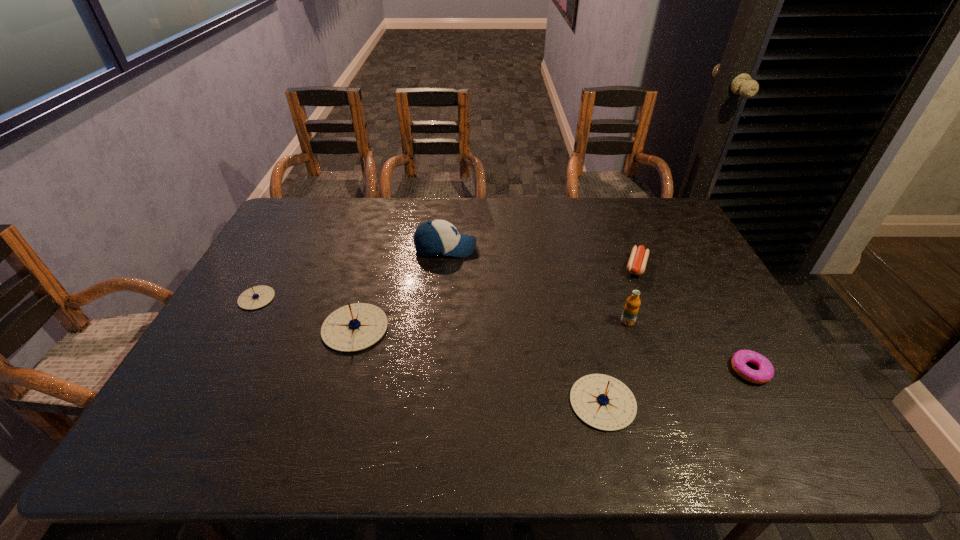
To ensure equal spacing by inserting another compass among them, please point out a vacant spot for this new compass. Please provide its 2D coordinates. Your answer should be formatted as a tuple, i.e. [(x, y)], where the tuple contains the x and y coordinates of a point satisfying the conditions above.

[(469, 362)]